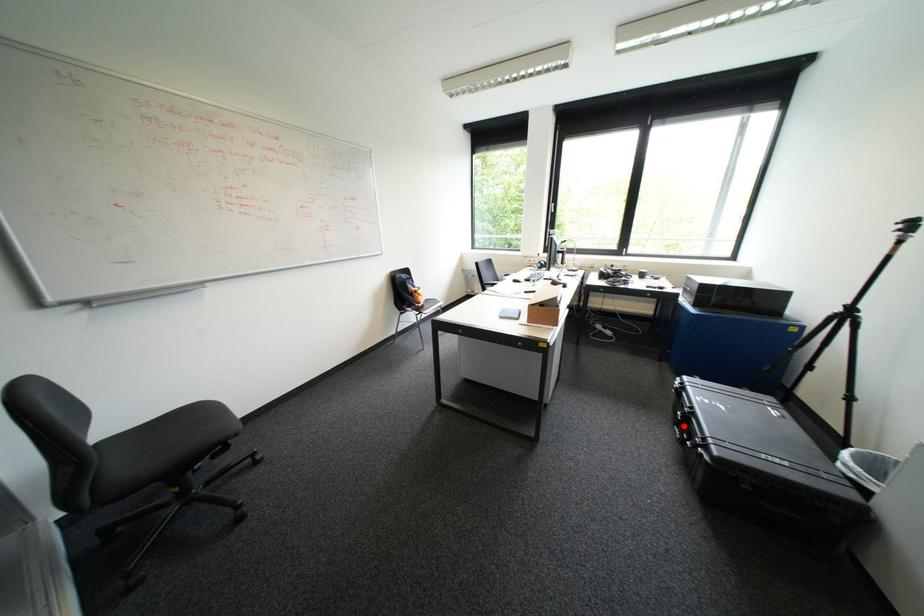
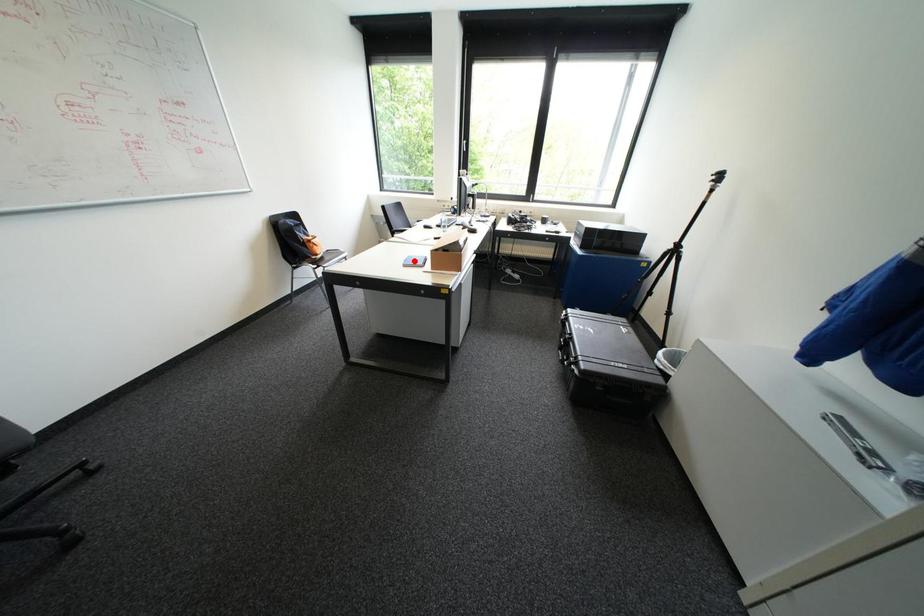
I am providing you with two images of the same scene from different viewpoints. A red point is marked on the first image and another point is marked on the second image. Is the red point in image1 aligned with the point shown in image2?

No